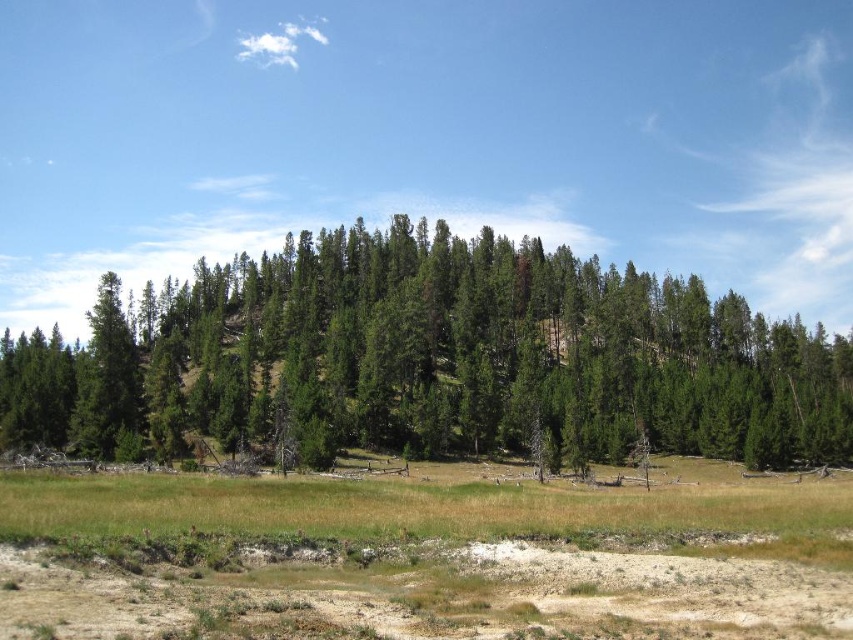
Can you confirm if green matte trees at center is wider than brown sandy dirt field at lower center?

Yes, green matte trees at center is wider than brown sandy dirt field at lower center.

The image size is (853, 640). What do you see at coordinates (432, 360) in the screenshot? I see `green matte trees at center` at bounding box center [432, 360].

Where is `green matte trees at center`? The height and width of the screenshot is (640, 853). green matte trees at center is located at coordinates (432, 360).